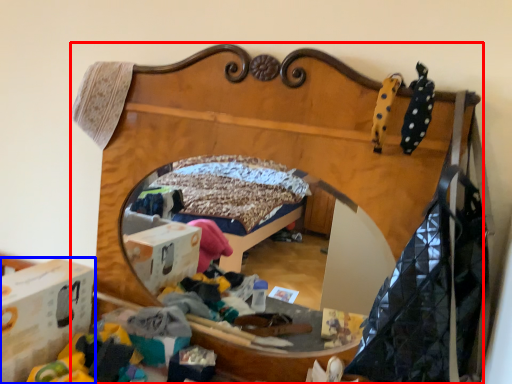
Question: Which object is closer to the camera taking this photo, furniture (highlighted by a red box) or cardboard box (highlighted by a blue box)?

Choices:
 (A) furniture
 (B) cardboard box

Answer: (A)